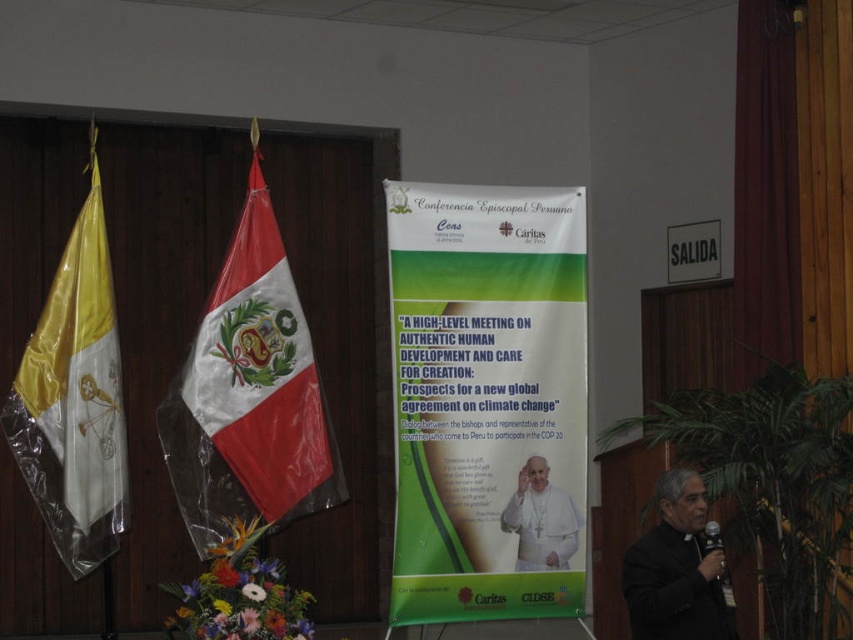
Question: Which point appears closest to the camera in this image?

Choices:
 (A) (235, 403)
 (B) (491, 326)
 (C) (563, 516)

Answer: (A)

Question: From the image, what is the correct spatial relationship of black matte priest at lower right in relation to white cloth at center?

Choices:
 (A) below
 (B) above

Answer: (A)

Question: Is black matte priest at lower right behind white cloth at center?

Choices:
 (A) no
 (B) yes

Answer: (A)

Question: Which of the following is the farthest from the observer?

Choices:
 (A) (697, 595)
 (B) (502, 513)
 (C) (39, 380)

Answer: (C)

Question: Does shiny plastic flag at left come in front of white cloth at center?

Choices:
 (A) no
 (B) yes

Answer: (B)

Question: Which point is closer to the camera taking this photo?

Choices:
 (A) (68, 316)
 (B) (693, 528)
 (C) (569, 506)

Answer: (B)